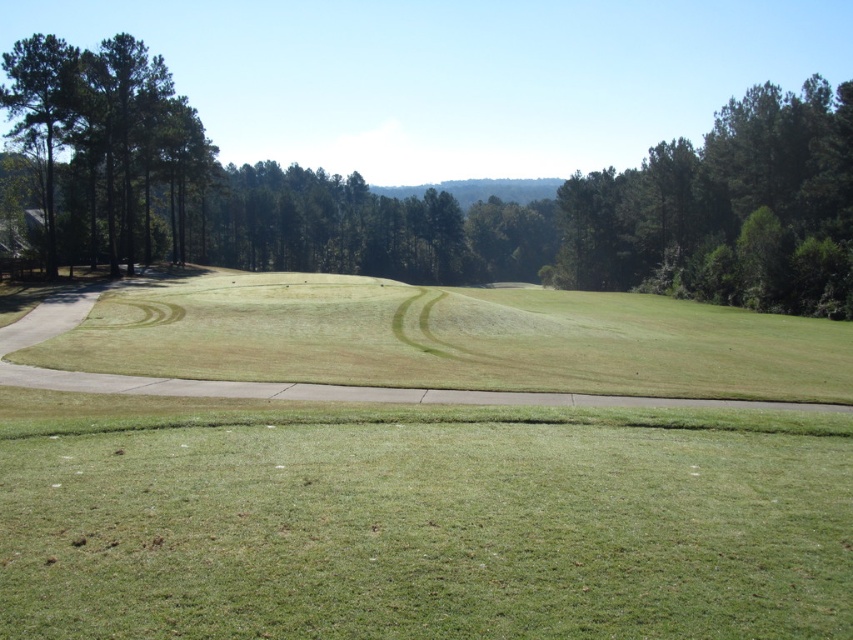
You are standing on the paved pathway in the center of the image. Which of the two trees, the green leafy tree at upper left or the green textured trees at left, is positioned higher up in the scene?

The green leafy tree at upper left is positioned higher up in the scene than the green textured trees at left.

You are standing on the paved pathway in the center of the image and want to walk towards the green leafy tree at upper left. Which direction should you turn to reach it without crossing the green grass at lower center?

You should turn to your right to reach the green leafy tree at upper left without crossing the green grass at lower center, since the green grass at lower center is positioned on the left side of the tree.

You are a golfer standing on the green grass at lower center and want to hit a ball towards the green leafy tree at upper left. Considering their heights, will the tree block your view of the ball once it reaches the tree?

The green grass at lower center is not as tall as the green leafy tree at upper left, so the tree is taller. Therefore, the tree may block your view of the ball once it reaches the tree.